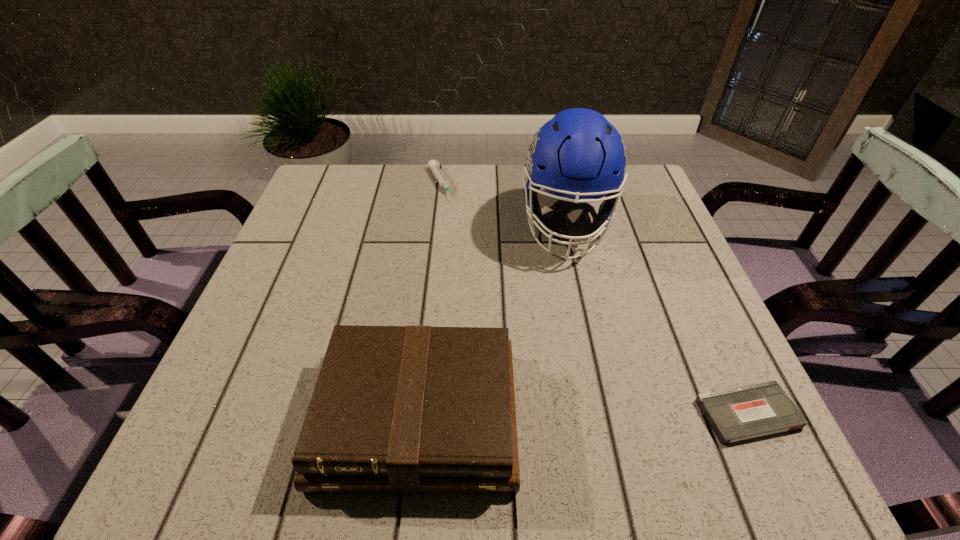
Identify the location of object positioned at the near right corner. The image size is (960, 540). (738, 414).

I want to click on free space at the far edge of the desktop, so click(488, 166).

Find the location of a particular element. The height and width of the screenshot is (540, 960). vacant space at the near edge is located at coordinates (560, 384).

The height and width of the screenshot is (540, 960). Find the location of `free space at the left edge of the desktop`. free space at the left edge of the desktop is located at coordinates (354, 231).

In order to click on free space at the right edge in this screenshot , I will do `click(652, 306)`.

You are a GUI agent. You are given a task and a screenshot of the screen. Output one action in this format:
    pyautogui.click(x=<x>, y=<y>)
    Task: Click on the blank space at the near right corner
    This screenshot has width=960, height=540.
    Given the screenshot: What is the action you would take?
    [669, 370]

You are a GUI agent. You are given a task and a screenshot of the screen. Output one action in this format:
    pyautogui.click(x=<x>, y=<y>)
    Task: Click on the blank region between the videotape and the third tallest object
    The image size is (960, 540).
    Given the screenshot: What is the action you would take?
    pyautogui.click(x=594, y=299)

Image resolution: width=960 pixels, height=540 pixels. In order to click on free spot between the third object from left to right and the second tallest object in this screenshot , I will do `click(492, 320)`.

Find the location of a particular element. The height and width of the screenshot is (540, 960). vacant area that lies between the Bible and the third object from left to right is located at coordinates (492, 320).

What are the coordinates of `empty space that is in between the Bible and the syringe` in the screenshot? It's located at (429, 300).